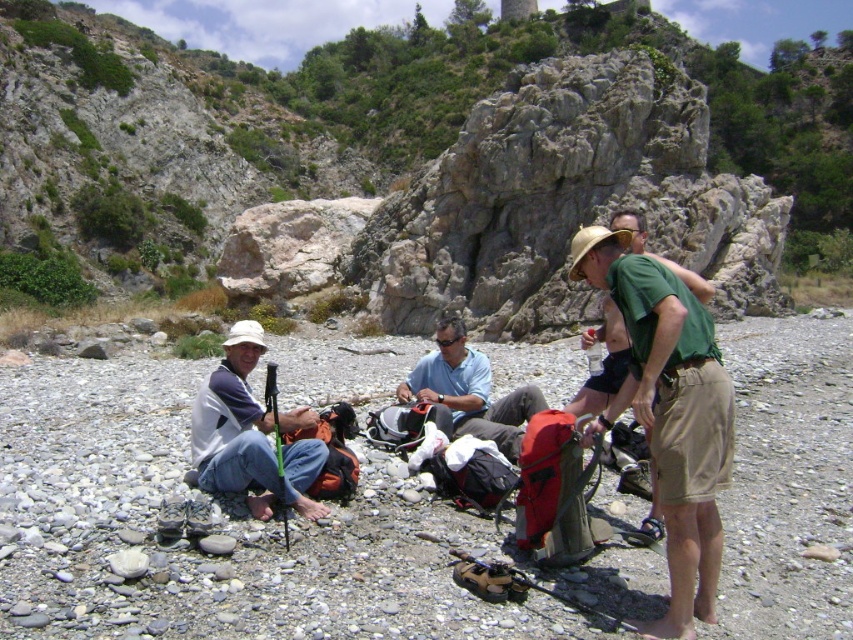
Question: Is khaki shorts at center closer to the viewer compared to light blue fabric shirt at center?

Choices:
 (A) no
 (B) yes

Answer: (B)

Question: Does khaki shorts at center appear on the left side of white matte hat at lower left?

Choices:
 (A) yes
 (B) no

Answer: (B)

Question: Does khaki shorts at center lie in front of white matte hat at lower left?

Choices:
 (A) yes
 (B) no

Answer: (A)

Question: Which point is closer to the camera taking this photo?

Choices:
 (A) [718, 522]
 (B) [254, 348]

Answer: (A)

Question: Considering the real-world distances, which object is farthest from the light blue fabric shirt at center?

Choices:
 (A) khaki shorts at center
 (B) white matte hat at lower left

Answer: (A)

Question: Which object appears farthest from the camera in this image?

Choices:
 (A) khaki shorts at center
 (B) light blue fabric shirt at center
 (C) white matte hat at lower left

Answer: (B)